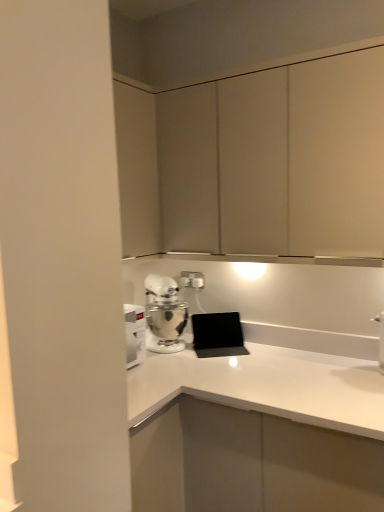
Measure the distance between matte white cabinet at upper center and camera.

matte white cabinet at upper center is 1.41 meters away from camera.

What do you see at coordinates (257, 162) in the screenshot? This screenshot has height=512, width=384. I see `matte white cabinet at upper center` at bounding box center [257, 162].

The height and width of the screenshot is (512, 384). What do you see at coordinates (164, 314) in the screenshot? I see `white metallic stand mixer at lower left` at bounding box center [164, 314].

This screenshot has width=384, height=512. In order to click on white plastic electric outlet at center in this screenshot , I will do `click(192, 279)`.

Is matte white cabinet at upper center touching white metallic stand mixer at lower left?

No, matte white cabinet at upper center is not beside white metallic stand mixer at lower left.

Who is taller, matte white cabinet at upper center or white metallic stand mixer at lower left?

Standing taller between the two is matte white cabinet at upper center.

Is matte white cabinet at upper center at the left side of white metallic stand mixer at lower left?

No, matte white cabinet at upper center is not to the left of white metallic stand mixer at lower left.

Is white metallic stand mixer at lower left taller or shorter than white plastic electric outlet at center?

Clearly, white metallic stand mixer at lower left is taller compared to white plastic electric outlet at center.

Is point (177, 328) positioned before point (200, 288)?

Yes, it is in front of point (200, 288).

In the image, there is a white metallic stand mixer at lower left. Identify the location of electric outlet above it (from the image's perspective). Image resolution: width=384 pixels, height=512 pixels. (192, 279).

Is white metallic stand mixer at lower left facing towards white plastic electric outlet at center?

No, white metallic stand mixer at lower left is not oriented towards white plastic electric outlet at center.

I want to click on dresser above the white plastic electric outlet at center (from the image's perspective), so click(x=257, y=162).

Based on the photo, is matte white cabinet at upper center positioned far away from white plastic electric outlet at center?

No, matte white cabinet at upper center is not far away from white plastic electric outlet at center.

Is white plastic electric outlet at center at the back of matte white cabinet at upper center?

No, matte white cabinet at upper center's orientation is not away from white plastic electric outlet at center.

Which of these two, white plastic electric outlet at center or matte white cabinet at upper center, is bigger?

Bigger between the two is matte white cabinet at upper center.

You are a GUI agent. You are given a task and a screenshot of the screen. Output one action in this format:
    pyautogui.click(x=<x>, y=<y>)
    Task: Click on the dresser above the white plastic electric outlet at center (from a real-world perspective)
    
    Given the screenshot: What is the action you would take?
    tap(257, 162)

Would you say white plastic electric outlet at center is to the left or to the right of matte white cabinet at upper center in the picture?

In the image, white plastic electric outlet at center appears on the left side of matte white cabinet at upper center.

Based on the photo, could you tell me if white plastic electric outlet at center is turned towards white metallic stand mixer at lower left?

Yes, white plastic electric outlet at center is oriented towards white metallic stand mixer at lower left.

Between white plastic electric outlet at center and white metallic stand mixer at lower left, which one has smaller size?

white plastic electric outlet at center.

Considering the sizes of objects white plastic electric outlet at center and white metallic stand mixer at lower left in the image provided, who is taller, white plastic electric outlet at center or white metallic stand mixer at lower left?

white metallic stand mixer at lower left.

Where is `home appliance on the left of the white plastic electric outlet at center`? home appliance on the left of the white plastic electric outlet at center is located at coordinates (164, 314).

From a real-world perspective, who is located lower, white metallic stand mixer at lower left or matte white cabinet at upper center?

In real-world perspective, white metallic stand mixer at lower left is lower.

Is there a large distance between white metallic stand mixer at lower left and matte white cabinet at upper center?

white metallic stand mixer at lower left is near matte white cabinet at upper center, not far away.

Does white metallic stand mixer at lower left appear on the left side of matte white cabinet at upper center?

Yes, white metallic stand mixer at lower left is to the left of matte white cabinet at upper center.

How much distance is there between white metallic stand mixer at lower left and matte white cabinet at upper center?

64.13 centimeters.

The image size is (384, 512). In order to click on dresser above the white metallic stand mixer at lower left (from the image's perspective) in this screenshot , I will do `click(257, 162)`.

Locate an element on the screen. home appliance below the white plastic electric outlet at center (from a real-world perspective) is located at coordinates (164, 314).

Looking at the image, which one is located further to matte white cabinet at upper center, white metallic stand mixer at lower left or white plastic electric outlet at center?

Among the two, white plastic electric outlet at center is located further to matte white cabinet at upper center.

Estimate the real-world distances between objects in this image. Which object is closer to white plastic electric outlet at center, white metallic stand mixer at lower left or matte white cabinet at upper center?

Based on the image, white metallic stand mixer at lower left appears to be nearer to white plastic electric outlet at center.

When comparing their distances from white metallic stand mixer at lower left, does white plastic electric outlet at center or matte white cabinet at upper center seem closer?

Among the two, white plastic electric outlet at center is located nearer to white metallic stand mixer at lower left.

Which object lies further to the anchor point white metallic stand mixer at lower left, matte white cabinet at upper center or white plastic electric outlet at center?

matte white cabinet at upper center is further to white metallic stand mixer at lower left.

Estimate the real-world distances between objects in this image. Which object is further from white plastic electric outlet at center, matte white cabinet at upper center or white metallic stand mixer at lower left?

matte white cabinet at upper center is further to white plastic electric outlet at center.

Looking at the image, which one is located further to matte white cabinet at upper center, white plastic electric outlet at center or white metallic stand mixer at lower left?

Based on the image, white plastic electric outlet at center appears to be further to matte white cabinet at upper center.

This screenshot has width=384, height=512. What are the coordinates of `home appliance between matte white cabinet at upper center and white plastic electric outlet at center along the z-axis` in the screenshot? It's located at (164, 314).